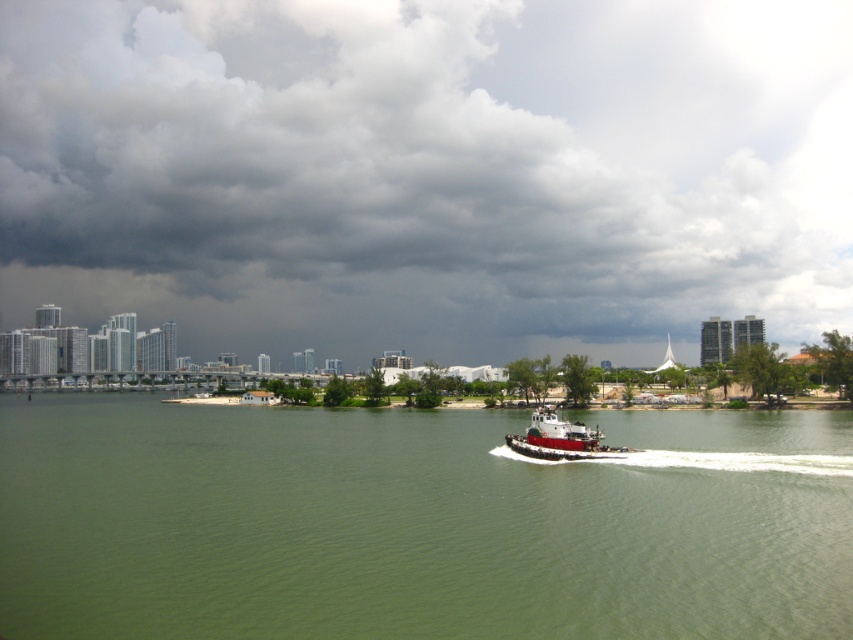
You are a weather observer analyzing the image. The dark gray cloud at upper center is at coordinates. Can you determine its position relative to the city skyline in the background?

The dark gray cloud at upper center is located at point (428, 173), which places it directly above the city skyline in the background.

You are standing on the tugboat and looking at two points in the scene. The first point is at coordinates point (376, 180) and the second point is at point (563, 438). Which point is closer to you?

Point (376, 180) is further to the camera than point (563, 438), so the point closer to you is point (563, 438).

Looking at this image, you are a photographer trying to capture the city skyline in the background. You notice the dark gray cloud at upper center and the green water at center. Which object is closer to the camera to potentially block your view of the skyline?

The dark gray cloud at upper center is closer to the camera than the green water at center, so it might block the view of the skyline.